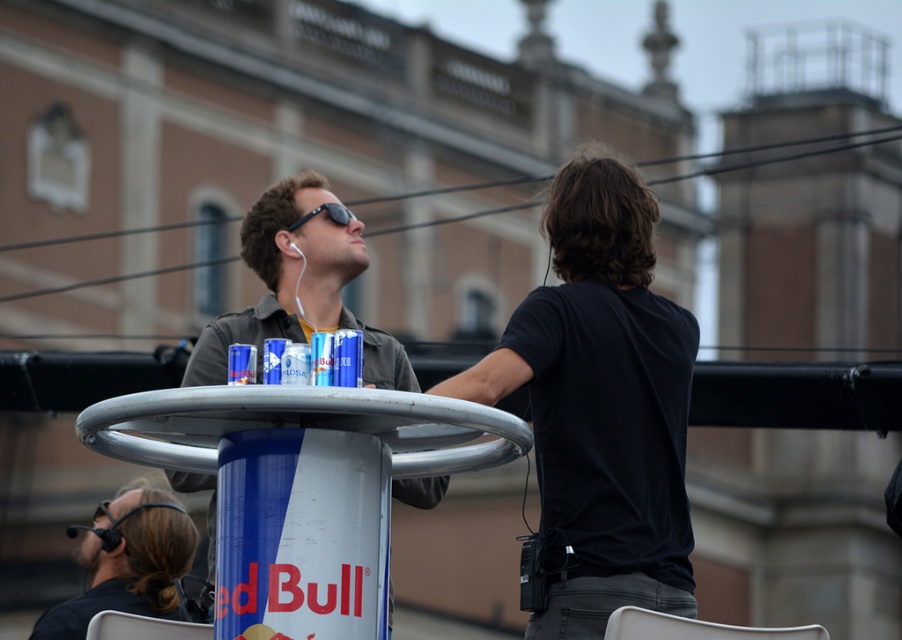
Question: Is black matte shirt at center below brown hair at lower left?

Choices:
 (A) no
 (B) yes

Answer: (A)

Question: Which of these objects is positioned closest to the brown hair at lower left?

Choices:
 (A) black matte shirt at center
 (B) matte black jacket at center

Answer: (B)

Question: Is the position of matte black jacket at center more distant than that of brown hair at lower left?

Choices:
 (A) yes
 (B) no

Answer: (B)

Question: Is matte black jacket at center above brown hair at lower left?

Choices:
 (A) no
 (B) yes

Answer: (B)

Question: Estimate the real-world distances between objects in this image. Which object is farther from the matte black jacket at center?

Choices:
 (A) brown hair at lower left
 (B) black matte shirt at center

Answer: (B)

Question: Based on their relative distances, which object is nearer to the black matte shirt at center?

Choices:
 (A) matte black jacket at center
 (B) brown hair at lower left

Answer: (A)